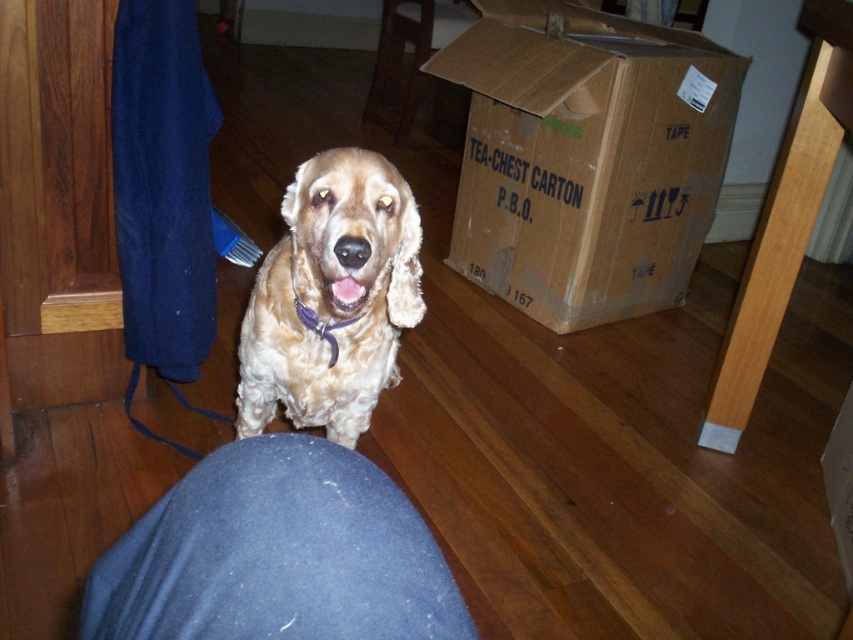
You are trying to decide whether to place a small table between the brown cardboard box at center and the golden fur dog at center. The table is 1.2 meters wide. Can the table fit between them based on their widths?

The brown cardboard box at center is wider than the golden fur dog at center. Since the table is 1.2 meters wide, it depends on the actual widths of the box and the dog. However, the description only states the box is wider, not the exact measurements, so we cannot determine if the table will fit.